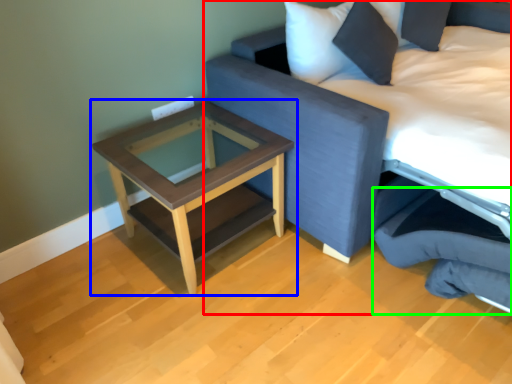
Question: Considering the real-world distances, which object is closest to studio couch (highlighted by a red box)? table (highlighted by a blue box) or swivel chair (highlighted by a green box).

Choices:
 (A) table
 (B) swivel chair

Answer: (B)